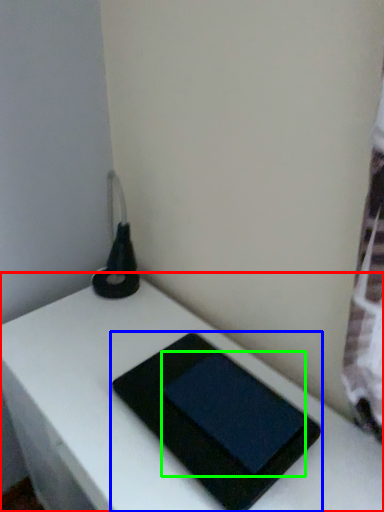
Question: Considering the real-world distances, which object is closest to table (highlighted by a red box)? tablet computer (highlighted by a blue box) or tablet computer (highlighted by a green box).

Choices:
 (A) tablet computer
 (B) tablet computer

Answer: (A)